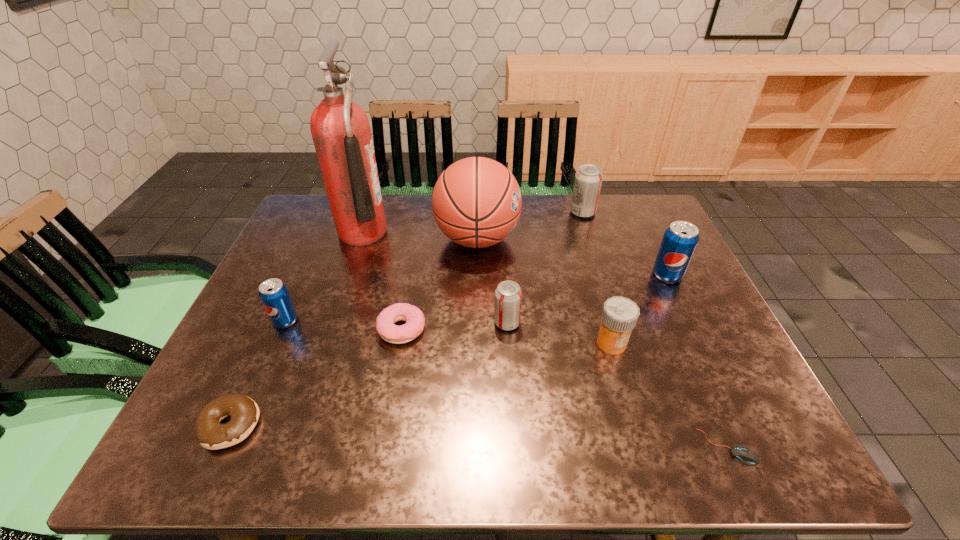
This screenshot has height=540, width=960. Identify the location of red fire extinguisher. (340, 128).

Locate an element on the screen. fire extinguisher is located at coordinates (340, 128).

Where is `basketball`? basketball is located at coordinates (476, 202).

Locate an element on the screen. Image resolution: width=960 pixels, height=540 pixels. orange basketball is located at coordinates (476, 202).

Locate an element on the screen. The width and height of the screenshot is (960, 540). the farther gray soda can is located at coordinates (588, 180).

This screenshot has height=540, width=960. Identify the location of the bigger gray soda can. (588, 180).

Identify the location of the bigger blue pop soda. (680, 239).

Locate an element on the screen. The image size is (960, 540). the rightmost soda can is located at coordinates (680, 239).

You are a GUI agent. You are given a task and a screenshot of the screen. Output one action in this format:
    pyautogui.click(x=<x>, y=<y>)
    Task: Click on the nearer blue pop soda
    The image size is (960, 540).
    Given the screenshot: What is the action you would take?
    pyautogui.click(x=274, y=295)

Where is `the leftmost soda can`? the leftmost soda can is located at coordinates (274, 295).